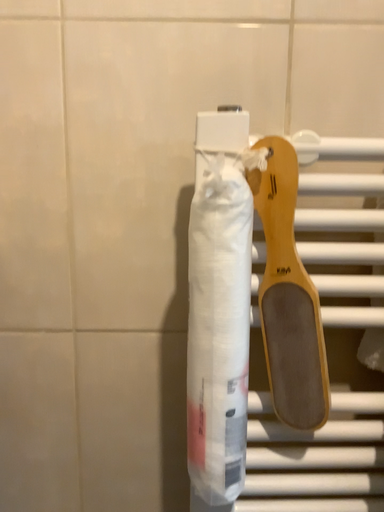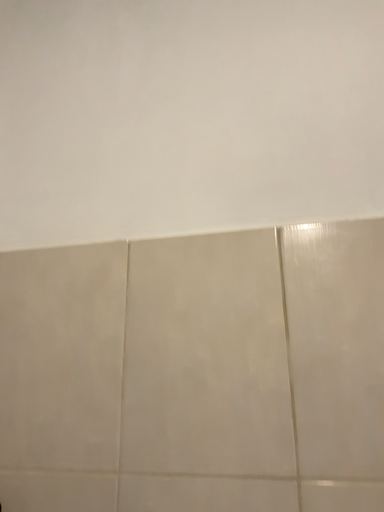
Question: Which way did the camera rotate in the video?

Choices:
 (A) rotated upward
 (B) rotated downward

Answer: (A)